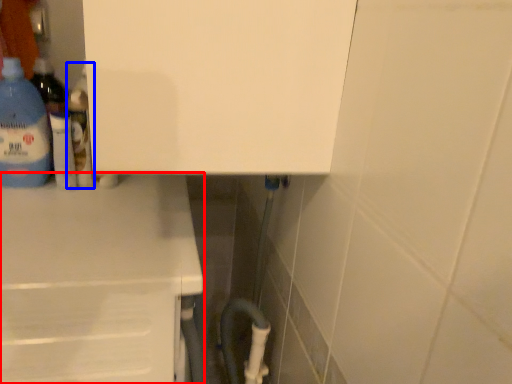
Question: Which object is closer to the camera taking this photo, counter (highlighted by a red box) or bottle (highlighted by a blue box)?

Choices:
 (A) counter
 (B) bottle

Answer: (A)